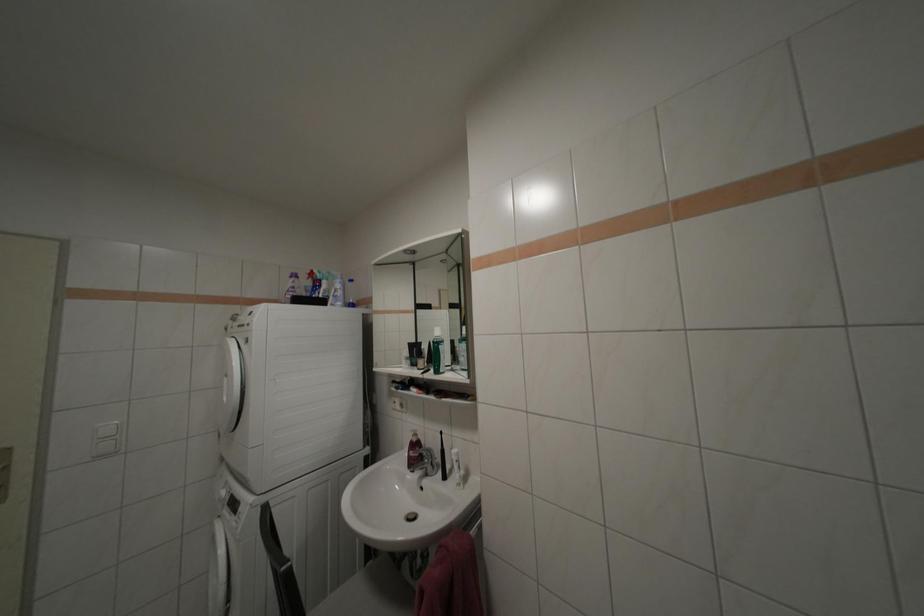
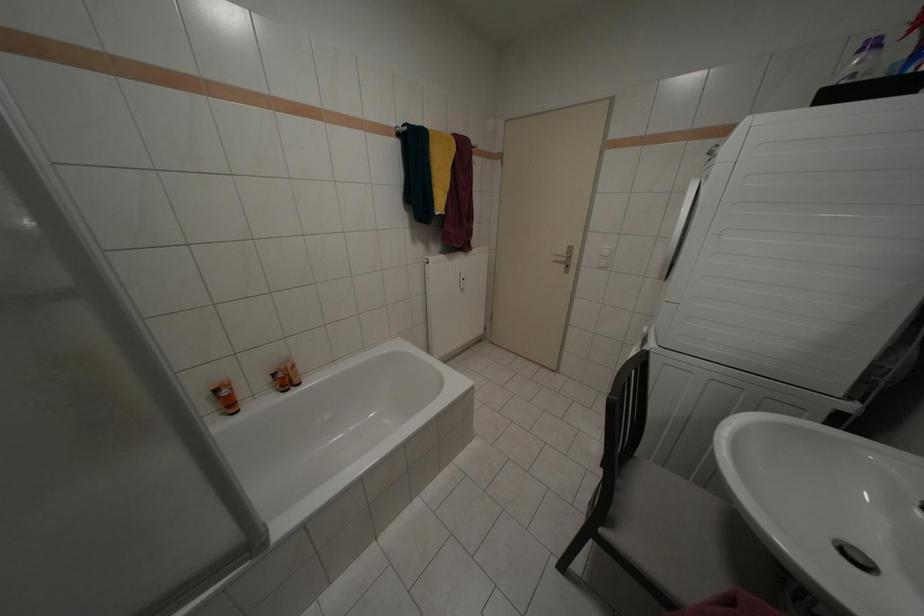
The images are taken continuously from a first-person perspective. In which direction is your viewpoint rotating?

The rotation direction of the camera is left-down.